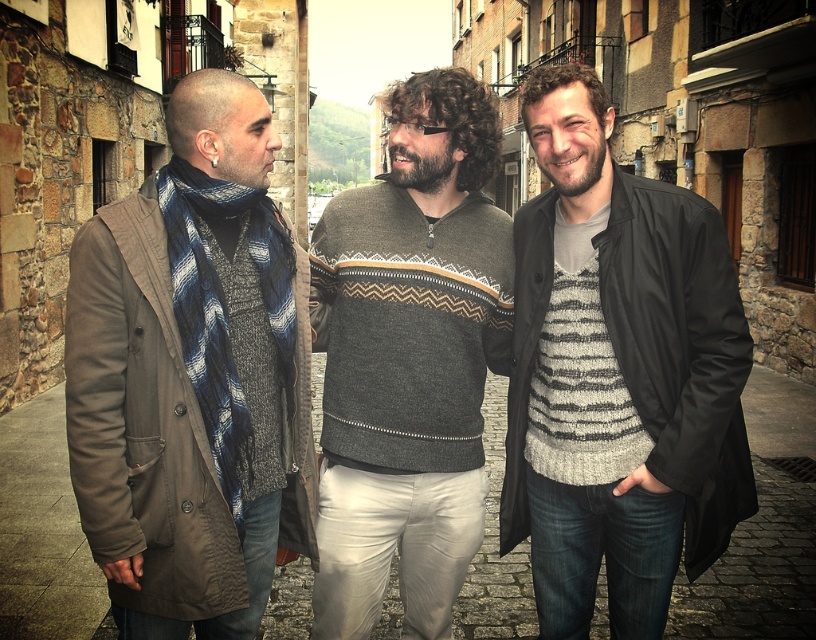
In the scene shown: Is striped knit sweater at center shorter than dark gray sweater at center?

Indeed, striped knit sweater at center has a lesser height compared to dark gray sweater at center.

Between point (593, 317) and point (398, 157), which one is positioned in front?

Point (593, 317) is more forward.

Between point (714, 557) and point (366, 573), which one is positioned in front?

Point (714, 557) is in front.

I want to click on striped knit sweater at center, so click(617, 376).

This screenshot has width=816, height=640. Describe the element at coordinates (617, 376) in the screenshot. I see `striped knit sweater at center` at that location.

Can you confirm if striped knit sweater at center is taller than knitted wool sweater at left?

Correct, striped knit sweater at center is much taller as knitted wool sweater at left.

Is point (526, 308) more distant than point (156, 484)?

That is True.

The image size is (816, 640). What are the coordinates of `striped knit sweater at center` in the screenshot? It's located at (617, 376).

Does dark gray sweater at center appear under knitted wool sweater at left?

Actually, dark gray sweater at center is above knitted wool sweater at left.

Does dark gray sweater at center have a greater width compared to knitted wool sweater at left?

Yes.

Is point (353, 273) more distant than point (183, 608)?

Yes, it is behind point (183, 608).

Identify the location of dark gray sweater at center. The height and width of the screenshot is (640, 816). (409, 358).